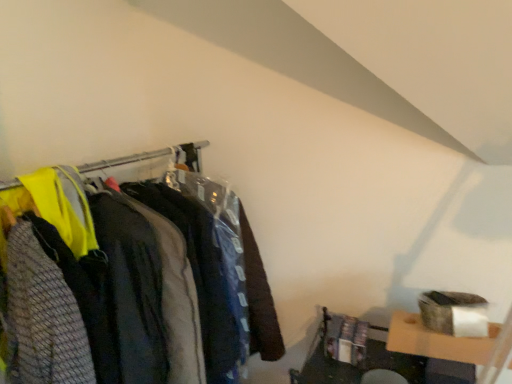
Question: Considering the relative sizes of textured gray sweater at left, which is counted as the first clothing, starting from the front, and dark gray fabric jacket at center, which appears as the 1th clothing when viewed from the back, in the image provided, is textured gray sweater at left, which is counted as the first clothing, starting from the front, shorter than dark gray fabric jacket at center, which appears as the 1th clothing when viewed from the back,?

Choices:
 (A) yes
 (B) no

Answer: (A)

Question: From the image's perspective, is textured gray sweater at left, the second clothing from the back, beneath dark gray fabric jacket at center, which appears as the 1th clothing when viewed from the back?

Choices:
 (A) yes
 (B) no

Answer: (A)

Question: From a real-world perspective, is textured gray sweater at left, the second clothing from the back, located beneath dark gray fabric jacket at center, the second clothing in the front-to-back sequence?

Choices:
 (A) no
 (B) yes

Answer: (A)

Question: Is textured gray sweater at left, the second clothing from the back, beside dark gray fabric jacket at center, which appears as the 1th clothing when viewed from the back?

Choices:
 (A) no
 (B) yes

Answer: (A)

Question: Does textured gray sweater at left, the second clothing from the back, have a smaller size compared to dark gray fabric jacket at center, which appears as the 1th clothing when viewed from the back?

Choices:
 (A) no
 (B) yes

Answer: (A)

Question: From a real-world perspective, is dark gray fabric jacket at center, the second clothing in the front-to-back sequence, physically located above or below textured gray sweater at left, the second clothing from the back?

Choices:
 (A) below
 (B) above

Answer: (A)

Question: Considering the positions of dark gray fabric jacket at center, the second clothing in the front-to-back sequence, and textured gray sweater at left, which is counted as the first clothing, starting from the front, in the image, is dark gray fabric jacket at center, the second clothing in the front-to-back sequence, bigger or smaller than textured gray sweater at left, which is counted as the first clothing, starting from the front,?

Choices:
 (A) big
 (B) small

Answer: (B)

Question: Considering the positions of dark gray fabric jacket at center, which appears as the 1th clothing when viewed from the back, and textured gray sweater at left, which is counted as the first clothing, starting from the front, in the image, is dark gray fabric jacket at center, which appears as the 1th clothing when viewed from the back, wider or thinner than textured gray sweater at left, which is counted as the first clothing, starting from the front,?

Choices:
 (A) wide
 (B) thin

Answer: (B)

Question: In terms of height, does dark gray fabric jacket at center, which appears as the 1th clothing when viewed from the back, look taller or shorter compared to textured gray sweater at left, the second clothing from the back?

Choices:
 (A) tall
 (B) short

Answer: (A)

Question: Is dark gray fabric jacket at center, the second clothing in the front-to-back sequence, taller or shorter than matte black clothing at left?

Choices:
 (A) short
 (B) tall

Answer: (A)

Question: In the image, is dark gray fabric jacket at center, the second clothing in the front-to-back sequence, positioned in front of or behind matte black clothing at left?

Choices:
 (A) front
 (B) behind

Answer: (B)

Question: From the image's perspective, is dark gray fabric jacket at center, the second clothing in the front-to-back sequence, located above or below matte black clothing at left?

Choices:
 (A) above
 (B) below

Answer: (A)

Question: From a real-world perspective, is dark gray fabric jacket at center, which appears as the 1th clothing when viewed from the back, above or below matte black clothing at left?

Choices:
 (A) above
 (B) below

Answer: (A)

Question: Considering the positions of matte black clothing at left and textured gray sweater at left, which is counted as the first clothing, starting from the front, in the image, is matte black clothing at left wider or thinner than textured gray sweater at left, which is counted as the first clothing, starting from the front,?

Choices:
 (A) thin
 (B) wide

Answer: (A)

Question: From the image's perspective, is matte black clothing at left located above or below textured gray sweater at left, which is counted as the first clothing, starting from the front?

Choices:
 (A) below
 (B) above

Answer: (A)